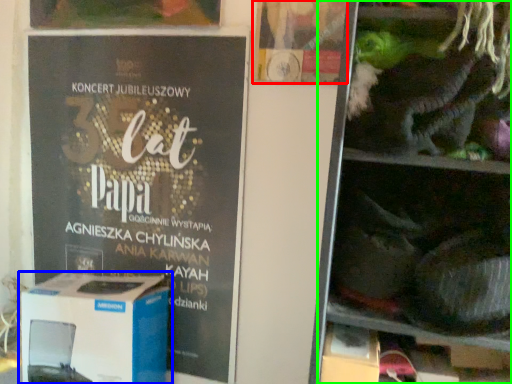
Question: Which object is the closest to the flyer (highlighted by a red box)? Choose among these: box (highlighted by a blue box) or shelf (highlighted by a green box).

Choices:
 (A) box
 (B) shelf

Answer: (B)